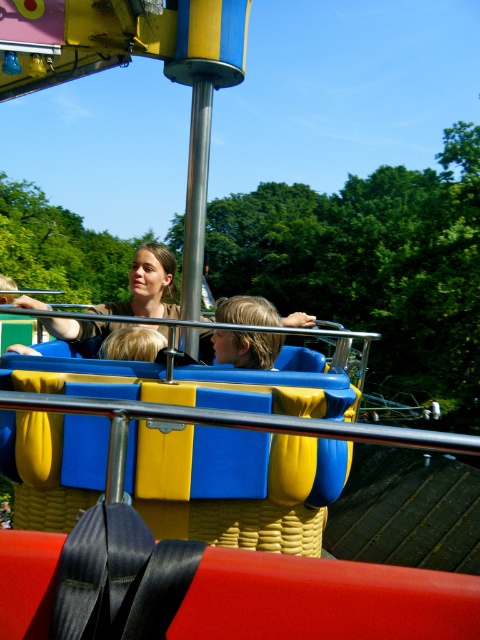
You are a photographer taking pictures of the matte brown shirt at center and the blonde hair at center from the front of the ride. Which one should you focus on first if you want to capture both in one shot?

The matte brown shirt at center is to the left of the blonde hair at center, so you should focus on the matte brown shirt at center first to ensure both are in frame.

From the picture: You are a photographer taking a picture of the matte brown shirt at center and the blonde hair at center from the front of the ride. Which object will appear taller in the photo?

The matte brown shirt at center will appear taller in the photo since it has a greater height compared to the blonde hair at center according to the description.